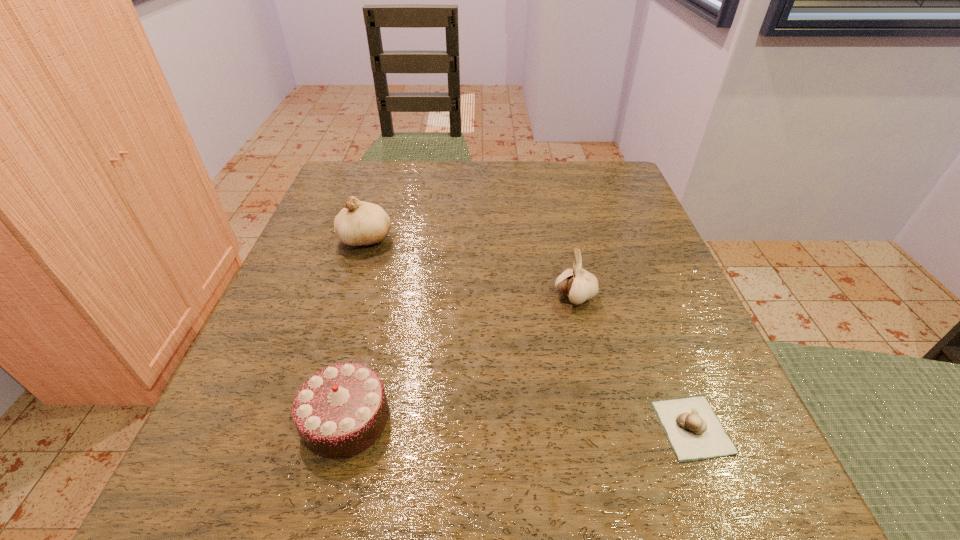
You are a GUI agent. You are given a task and a screenshot of the screen. Output one action in this format:
    pyautogui.click(x=<x>, y=<y>)
    Task: Click on the vacant space situated on the left of the shortest garlic
    The width and height of the screenshot is (960, 540).
    Given the screenshot: What is the action you would take?
    pyautogui.click(x=493, y=427)

Where is `chocolate cake that is at the near edge`? This screenshot has width=960, height=540. chocolate cake that is at the near edge is located at coordinates pos(340,411).

Find the location of a particular element. This screenshot has width=960, height=540. garlic present at the near edge is located at coordinates (694, 431).

The image size is (960, 540). I want to click on garlic positioned at the left edge, so click(360, 223).

This screenshot has width=960, height=540. In order to click on chocolate cake that is at the left edge in this screenshot , I will do `click(340, 411)`.

Where is `object positioned at the near left corner`? object positioned at the near left corner is located at coordinates pos(340,411).

Locate an element on the screen. object that is at the near right corner is located at coordinates (694, 431).

This screenshot has height=540, width=960. Identify the location of vacant region at the far edge. (480, 161).

This screenshot has width=960, height=540. Identify the location of vacant area at the near edge. (394, 516).

The image size is (960, 540). I want to click on vacant space at the left edge of the desktop, so click(264, 320).